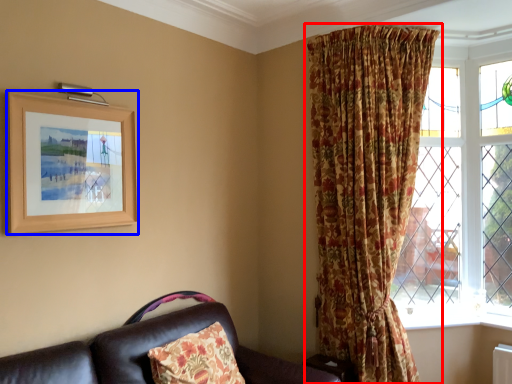
Question: Which object appears closest to the camera in this image, curtain (highlighted by a red box) or picture frame (highlighted by a blue box)?

Choices:
 (A) curtain
 (B) picture frame

Answer: (B)